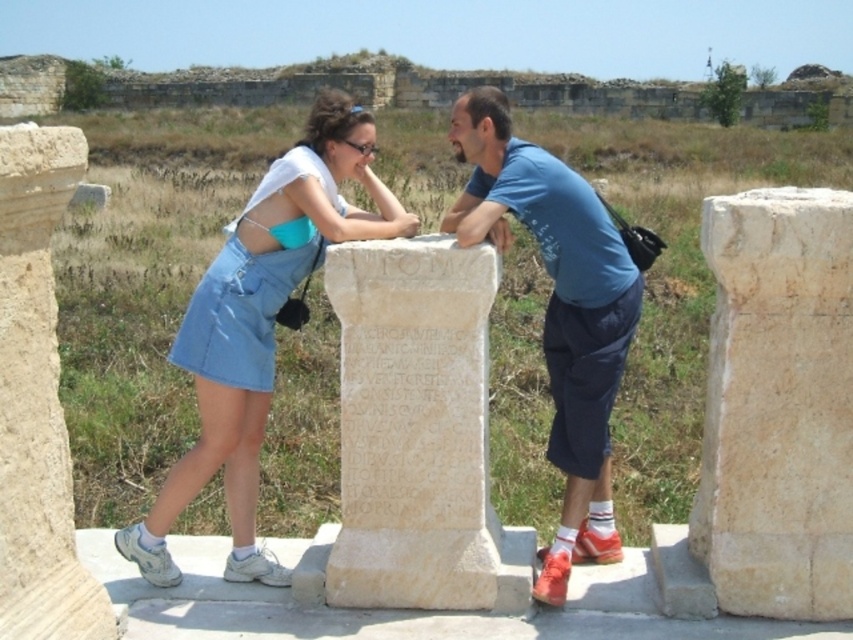
You are a tour guide explaining the archaeological site to visitors. You point to two points on the monument. The first point is at coordinate point (163,508) and the second point is at coordinate point (47,484). Which point is closer to the visitors?

Point (163,508) is further to the viewer than point (47,484), so the point closer to the visitors is point (47,484).

You are standing at the archaeological site and want to take a photo of both point (811, 436) and point (297, 164) in the image. Which point should you focus on first to ensure both are in the frame?

You should focus on point (297, 164) first because it is behind point (811, 436), so focusing on the closer point might cause the background point to be out of focus. By focusing on the farther point first, you can ensure both are in the frame.

You are a tour guide explaining the archaeological site to visitors. You point out the beige stone pillar at right and the denim skirt at center. Which object is located to the right of the other?

The beige stone pillar at right is positioned on the right side of denim skirt at center.